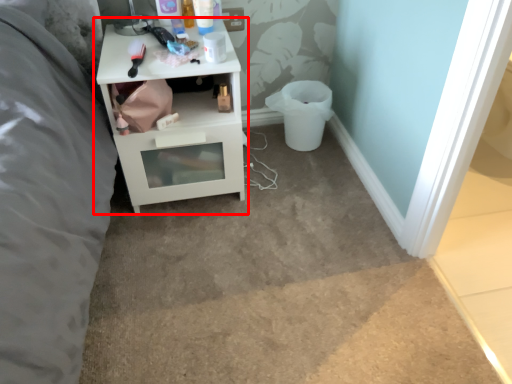
Question: From the image, what is the correct spatial relationship of nightstand (annotated by the red box) in relation to toilet bowl?

Choices:
 (A) left
 (B) right

Answer: (A)